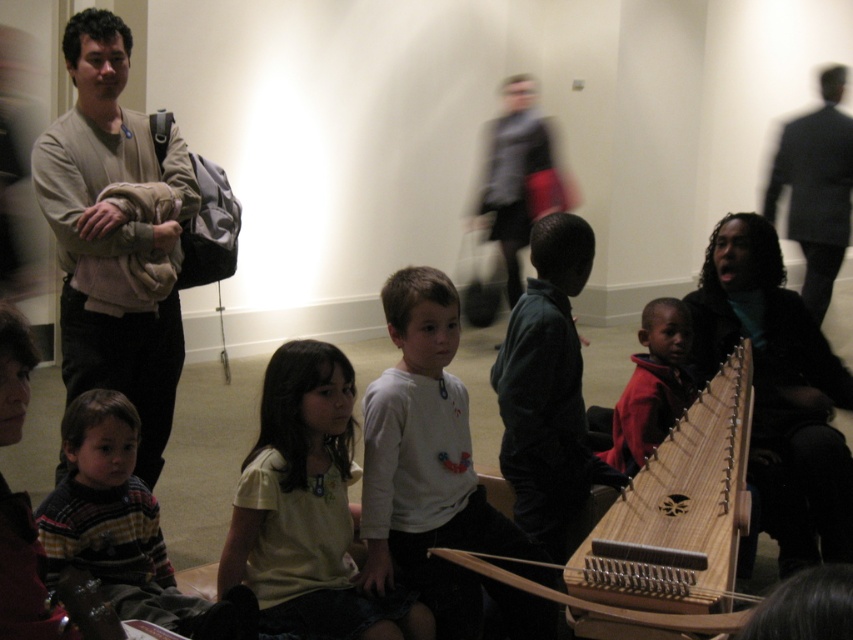
You are a photographer trying to capture a clear shot of the light brown sweater at left and the wooden string instrument at center. Given the scene is slightly blurred, which object would be easier to focus on?

The wooden string instrument at center would be easier to focus on because it is wider than the light brown sweater at left, making it a larger target for the camera.

You are a photographer trying to capture a group photo of the light yellow shirt at center and the striped sweater at lower left. The camera you have can only focus on objects within a 25 cm range. Will both subjects be in focus?

The distance between the light yellow shirt at center and the striped sweater at lower left is 30.65 centimeters, which exceeds the camera focus range of 25 cm. Therefore, both subjects cannot be in focus simultaneously.